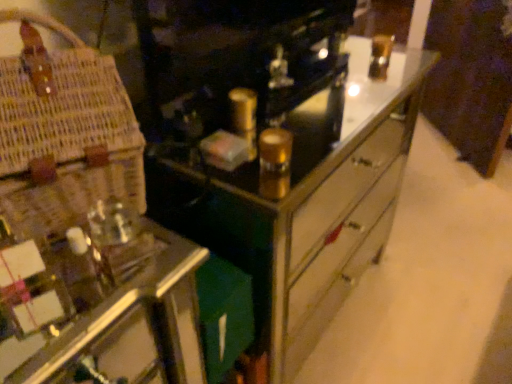
Question: Based on their sizes in the image, would you say metallic mirrored chest of drawers at center is bigger or smaller than woven straw basket at left?

Choices:
 (A) small
 (B) big

Answer: (B)

Question: Relative to woven straw basket at left, is metallic mirrored chest of drawers at center in front or behind?

Choices:
 (A) behind
 (B) front

Answer: (A)

Question: Is metallic mirrored chest of drawers at center wider or thinner than woven straw basket at left?

Choices:
 (A) wide
 (B) thin

Answer: (A)

Question: From the image's perspective, is woven straw basket at left positioned above or below metallic mirrored chest of drawers at center?

Choices:
 (A) above
 (B) below

Answer: (A)

Question: In the image, is woven straw basket at left on the left side or the right side of metallic mirrored chest of drawers at center?

Choices:
 (A) left
 (B) right

Answer: (A)

Question: Based on their sizes in the image, would you say woven straw basket at left is bigger or smaller than metallic mirrored chest of drawers at center?

Choices:
 (A) small
 (B) big

Answer: (A)

Question: Is woven straw basket at left taller or shorter than metallic mirrored chest of drawers at center?

Choices:
 (A) tall
 (B) short

Answer: (B)